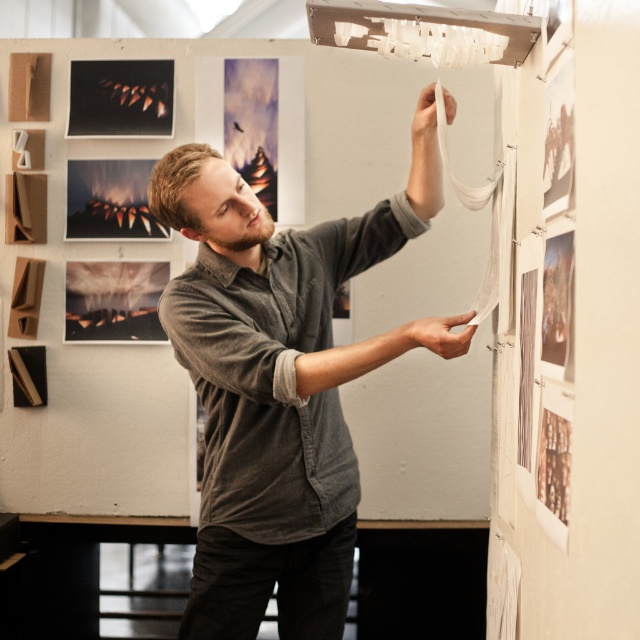
Question: Which of these objects is positioned closest to the matte black artwork at upper left?

Choices:
 (A) matte black photograph at lower left
 (B) matte black paper at upper left
 (C) gray cotton shirt at center

Answer: (A)

Question: Which point is closer to the camera taking this photo?

Choices:
 (A) (92, 134)
 (B) (93, 272)
 (C) (220, 291)
 (D) (108, 202)

Answer: (C)

Question: Can you confirm if matte black paper at upper left is bigger than matte black artwork at upper left?

Choices:
 (A) no
 (B) yes

Answer: (A)

Question: Is gray cotton shirt at center smaller than matte black photograph at lower left?

Choices:
 (A) no
 (B) yes

Answer: (A)

Question: Is matte black paper at upper left bigger than matte black photograph at lower left?

Choices:
 (A) no
 (B) yes

Answer: (A)

Question: Which object appears closest to the camera in this image?

Choices:
 (A) matte black artwork at upper left
 (B) matte black photograph at lower left

Answer: (B)